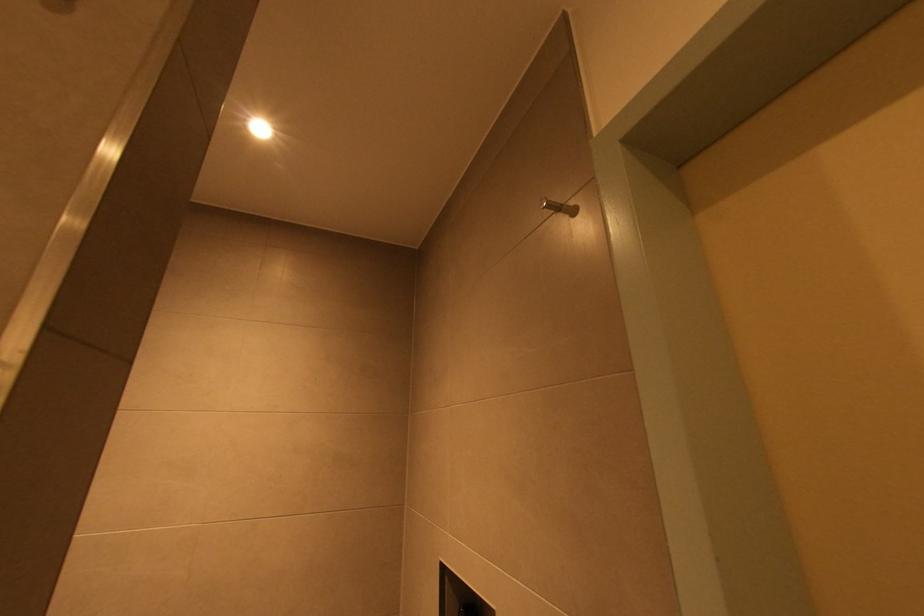
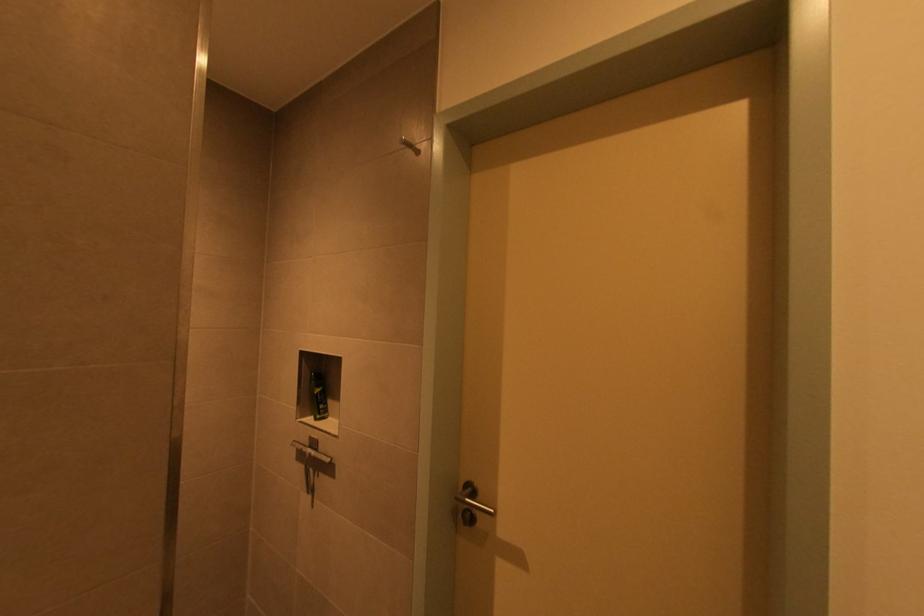
First-person continuous shooting, in which direction is the camera rotating?

The camera rotated toward right-down.